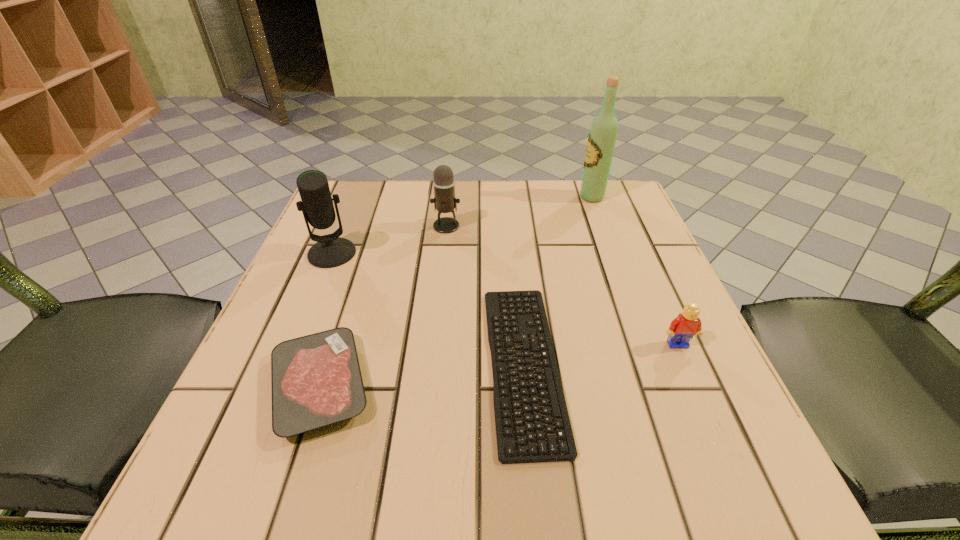
Identify the location of vacant area at the left edge. (346, 301).

Find the location of a particular element. The image size is (960, 540). vacant region at the right edge of the desktop is located at coordinates (706, 379).

This screenshot has height=540, width=960. Find the location of `free location at the far left corner of the desktop`. free location at the far left corner of the desktop is located at coordinates tap(361, 214).

This screenshot has width=960, height=540. In the image, there is a desktop. Find the location of `vacant space at the near left corner`. vacant space at the near left corner is located at coordinates (218, 446).

The height and width of the screenshot is (540, 960). In the image, there is a desktop. Identify the location of blank space at the far right corner. (587, 214).

Image resolution: width=960 pixels, height=540 pixels. I want to click on vacant area that lies between the third shortest object and the farther microphone, so click(x=563, y=285).

You are a GUI agent. You are given a task and a screenshot of the screen. Output one action in this format:
    pyautogui.click(x=<x>, y=<y>)
    Task: Click on the free point between the second shortest object and the farther microphone
    
    Given the screenshot: What is the action you would take?
    pyautogui.click(x=383, y=306)

The height and width of the screenshot is (540, 960). I want to click on vacant space in between the computer keyboard and the wine bottle, so click(558, 280).

Identify the location of free space that is in between the farther microphone and the wine bottle. (519, 212).

This screenshot has height=540, width=960. In order to click on vacant area between the computer keyboard and the farthest object in this screenshot , I will do `click(558, 280)`.